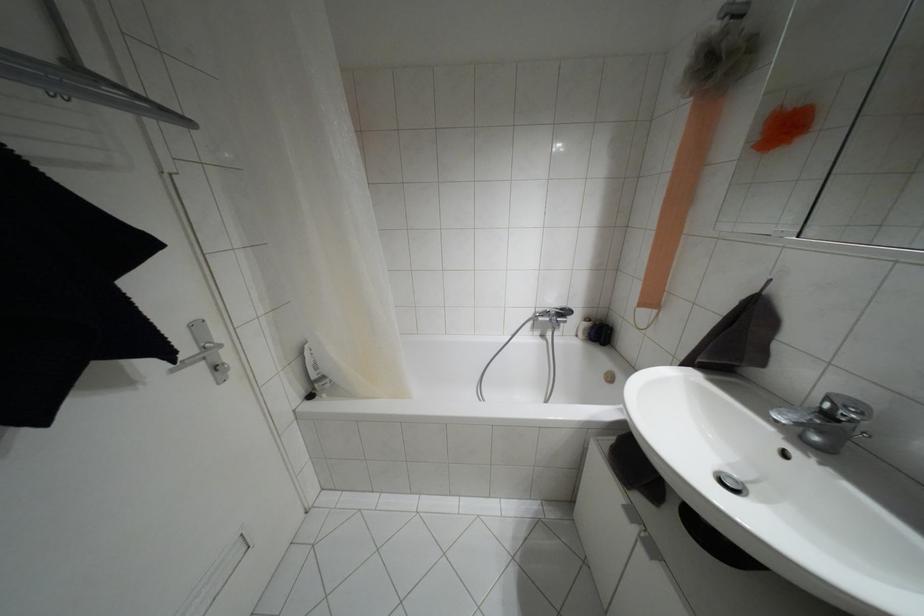
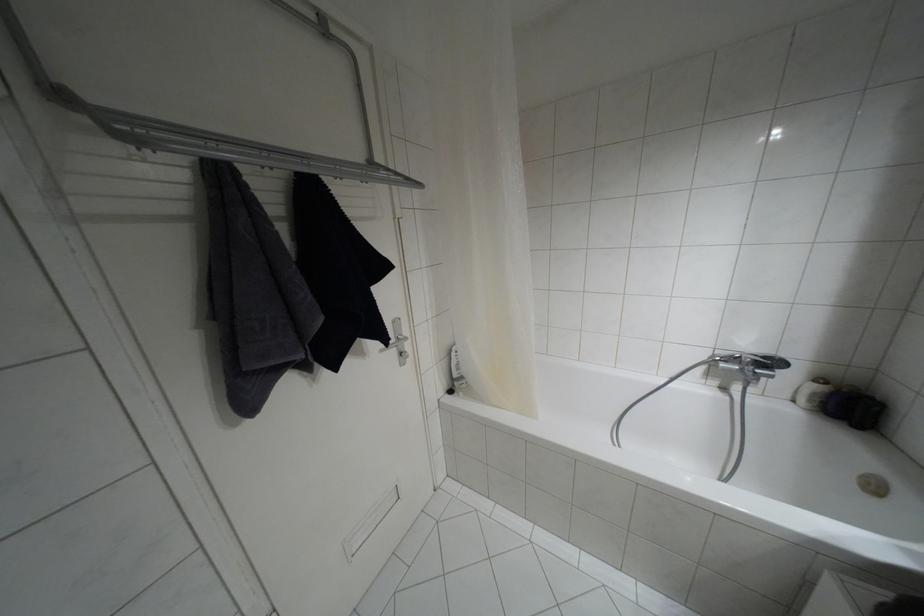
Locate, in the second image, the point that corresponds to pixel 219 345 in the first image.

(406, 338)